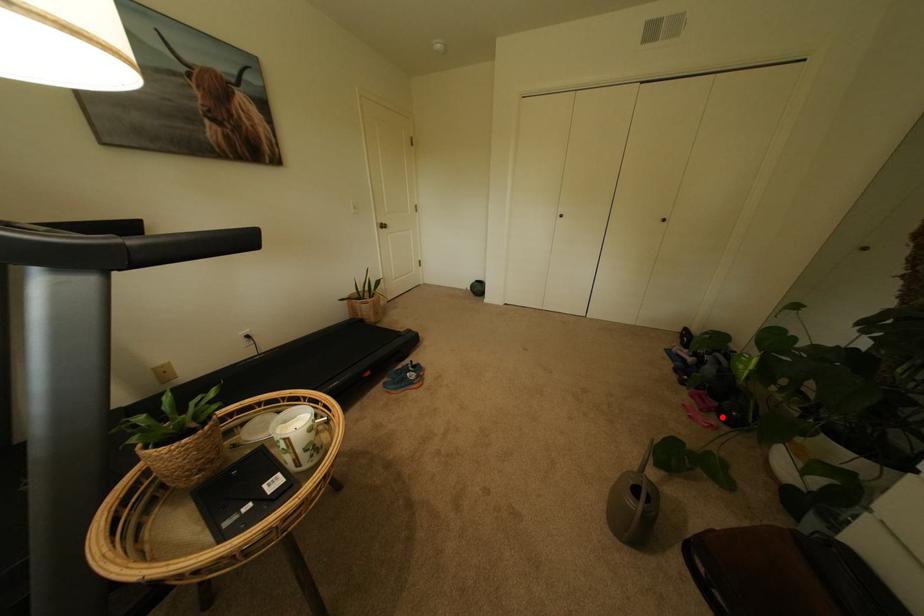
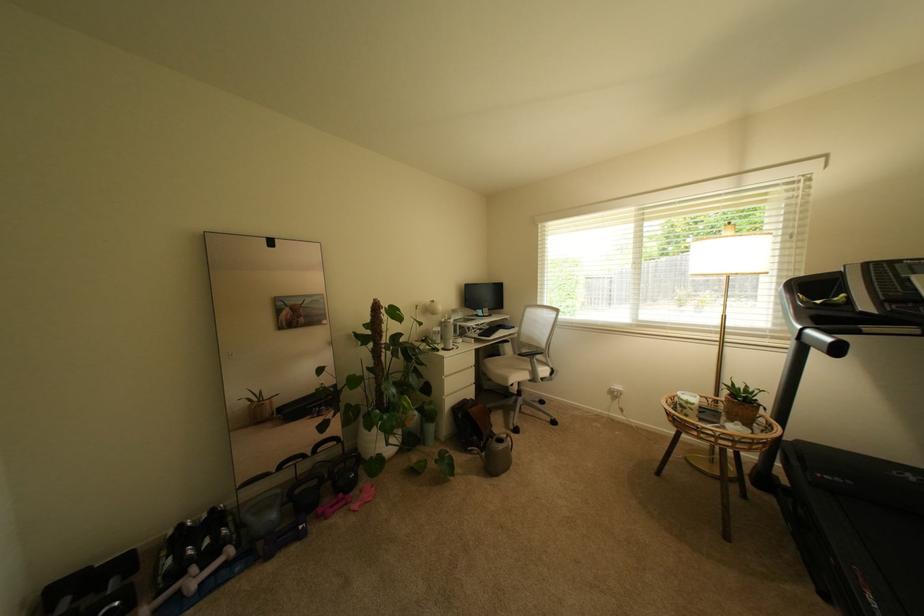
Locate, in the second image, the point that corresponds to the highlighted location in the first image.

(359, 495)